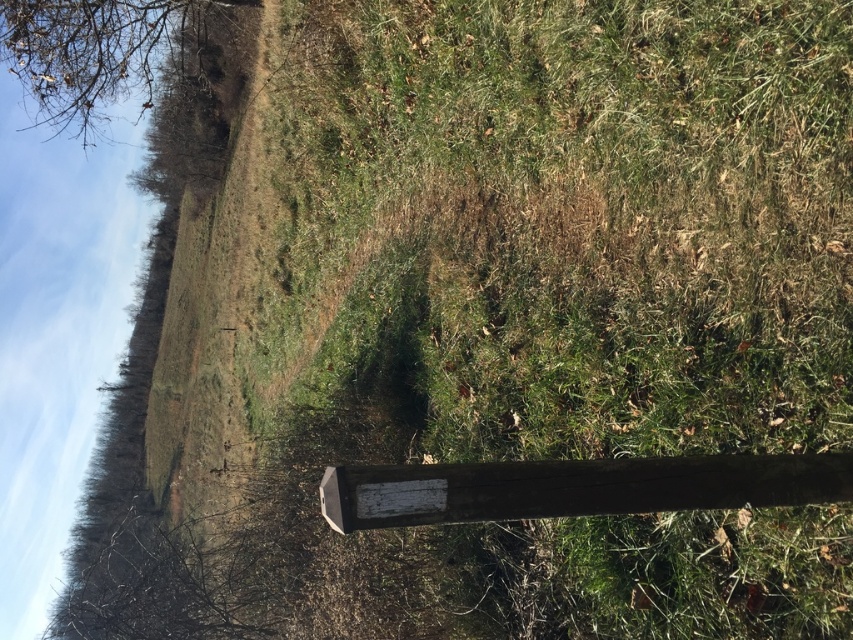
Question: Does weathered wood signpost at lower center come behind brown bark tree at upper left?

Choices:
 (A) yes
 (B) no

Answer: (B)

Question: Which object is farther from the camera taking this photo?

Choices:
 (A) brown bark tree at upper left
 (B) weathered wood signpost at lower center

Answer: (A)

Question: Is weathered wood signpost at lower center positioned behind brown bark tree at upper left?

Choices:
 (A) no
 (B) yes

Answer: (A)

Question: Is weathered wood signpost at lower center to the right of brown bark tree at upper left from the viewer's perspective?

Choices:
 (A) no
 (B) yes

Answer: (B)

Question: Which point is farther to the camera?

Choices:
 (A) weathered wood signpost at lower center
 (B) brown bark tree at upper left

Answer: (B)